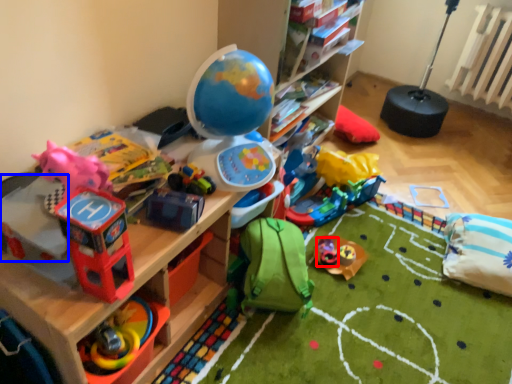
Question: Which of the following is the closest to the observer, toy (highlighted by a red box) or toy (highlighted by a blue box)?

Choices:
 (A) toy
 (B) toy

Answer: (B)